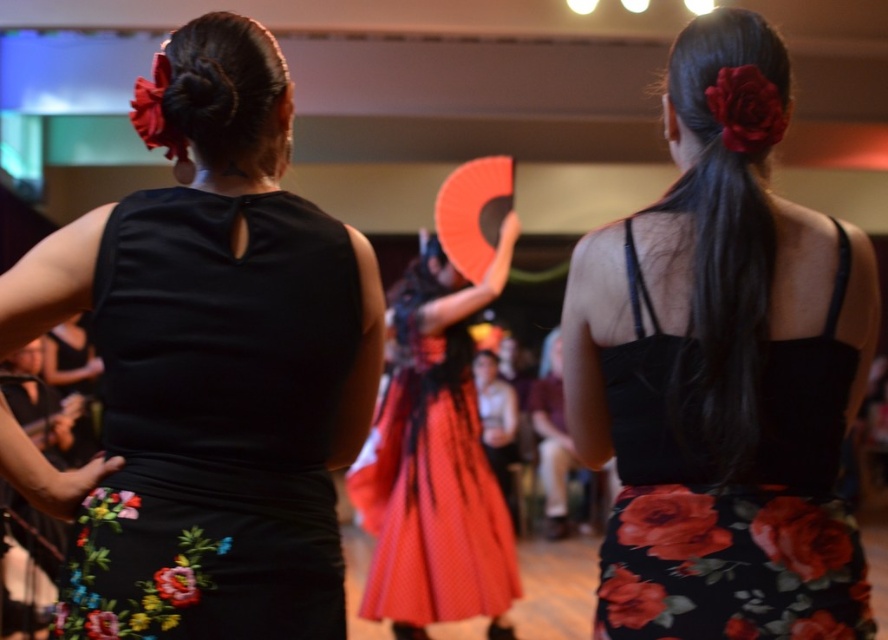
Does black satin dress at center have a lesser height compared to black silky hair at upper center?

No.

You are a GUI agent. You are given a task and a screenshot of the screen. Output one action in this format:
    pyautogui.click(x=<x>, y=<y>)
    Task: Click on the black satin dress at center
    The image size is (888, 640).
    Given the screenshot: What is the action you would take?
    pyautogui.click(x=212, y=362)

You are a GUI agent. You are given a task and a screenshot of the screen. Output one action in this format:
    pyautogui.click(x=<x>, y=<y>)
    Task: Click on the black satin dress at center
    The width and height of the screenshot is (888, 640).
    Given the screenshot: What is the action you would take?
    pyautogui.click(x=212, y=362)

Which is behind, point (353, 326) or point (199, 26)?

Point (353, 326)

Is black satin dress at center to the left of dark brown silky hair bun at upper left from the viewer's perspective?

Indeed, black satin dress at center is positioned on the left side of dark brown silky hair bun at upper left.

Where is `black satin dress at center`? The height and width of the screenshot is (640, 888). black satin dress at center is located at coordinates (212, 362).

At what (x,y) coordinates should I click in order to perform the action: click on black satin dress at center. Please return your answer as a coordinate pair (x, y). Image resolution: width=888 pixels, height=640 pixels. Looking at the image, I should click on (212, 362).

Which is above, black silky hair at upper center or dark brown silky hair bun at upper left?

dark brown silky hair bun at upper left is above.

Is black silky hair at upper center above dark brown silky hair bun at upper left?

Actually, black silky hair at upper center is below dark brown silky hair bun at upper left.

Is point (718, 186) farther from camera compared to point (207, 38)?

Yes, it is.

Locate an element on the screen. black silky hair at upper center is located at coordinates (726, 220).